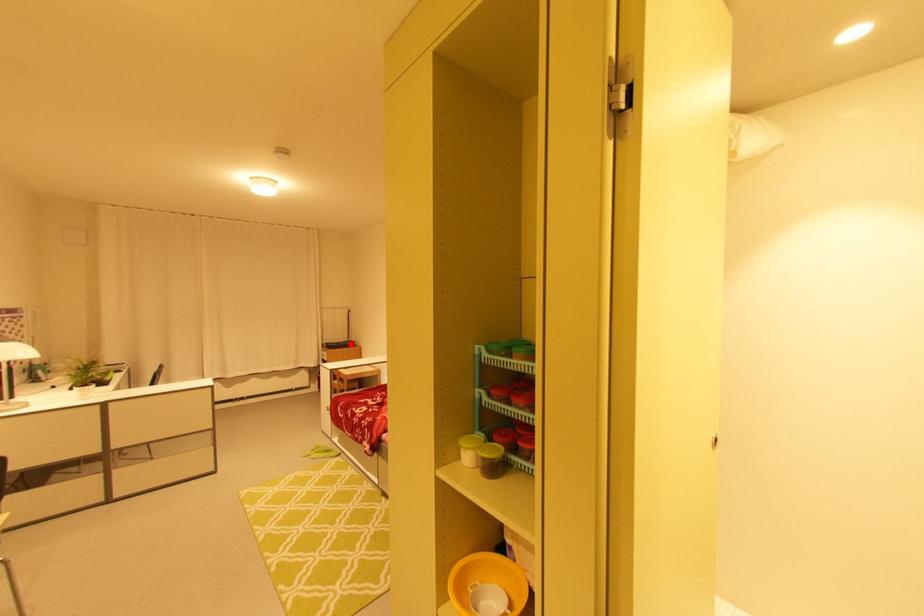
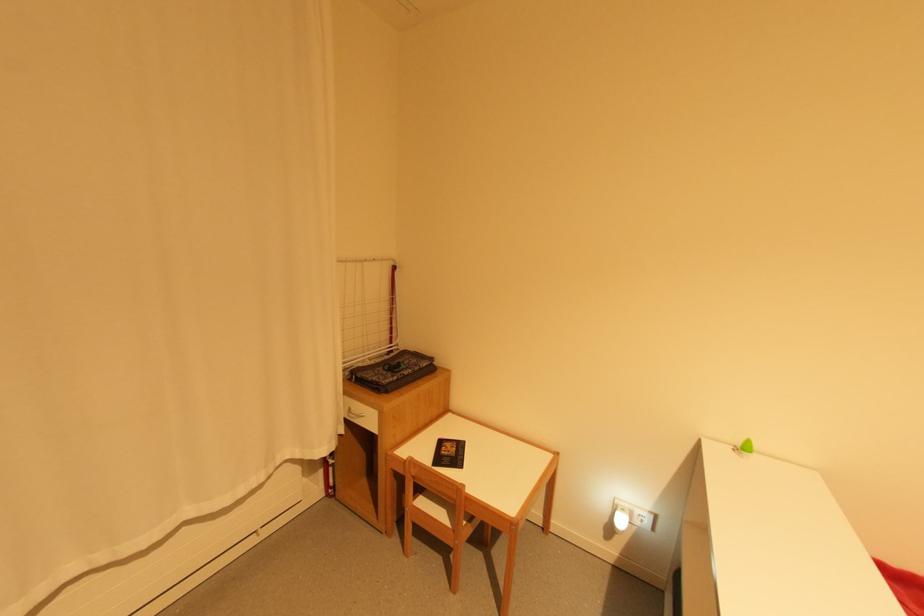
Find the pixel in the second image that matches the highlighted location in the first image.

(421, 369)